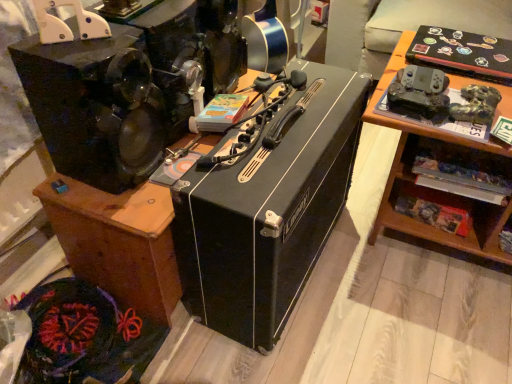
Question: Looking at their shapes, would you say black matte amplifier at center is wider or thinner than black matte amplifier at center?

Choices:
 (A) thin
 (B) wide

Answer: (A)

Question: Considering the positions of point (314, 238) and point (67, 258), is point (314, 238) closer or farther from the camera than point (67, 258)?

Choices:
 (A) farther
 (B) closer

Answer: (B)

Question: From a real-world perspective, relative to black matte amplifier at center, is black matte amplifier at center vertically above or below?

Choices:
 (A) below
 (B) above

Answer: (B)

Question: From the image's perspective, is black matte amplifier at center positioned above or below black matte amplifier at center?

Choices:
 (A) below
 (B) above

Answer: (B)

Question: Considering the positions of black matte amplifier at center and black matte amplifier at center in the image, is black matte amplifier at center bigger or smaller than black matte amplifier at center?

Choices:
 (A) small
 (B) big

Answer: (B)

Question: In terms of width, does black matte amplifier at center look wider or thinner when compared to black matte amplifier at center?

Choices:
 (A) wide
 (B) thin

Answer: (A)

Question: Would you say black matte amplifier at center is to the left or to the right of black matte amplifier at center in the picture?

Choices:
 (A) left
 (B) right

Answer: (A)